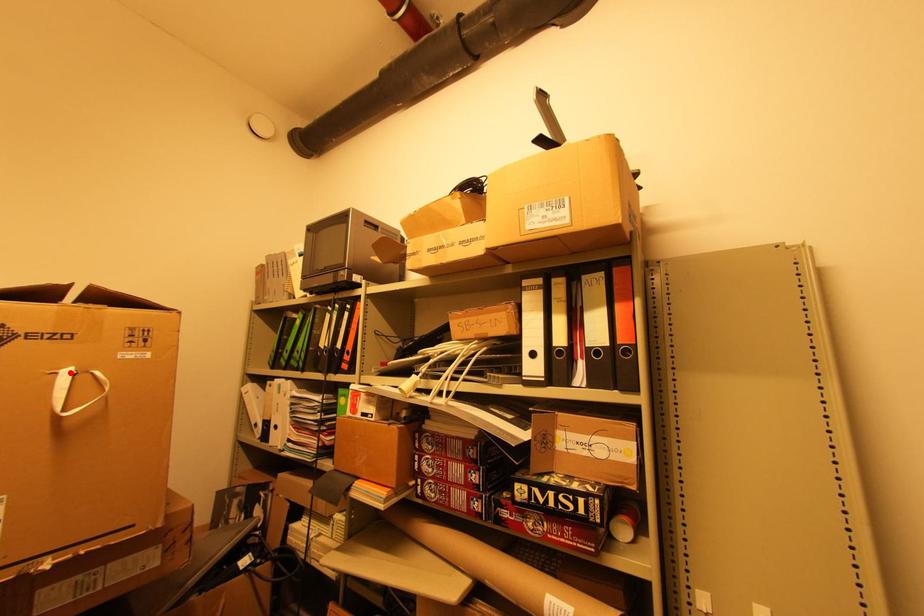
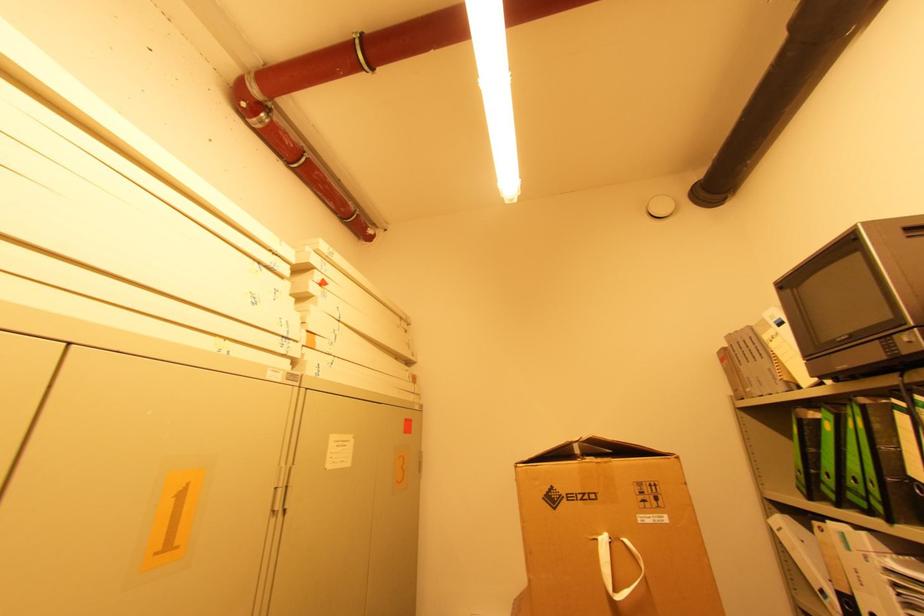
Locate, in the second image, the point that corresponds to the highlighted location in the first image.

(608, 541)